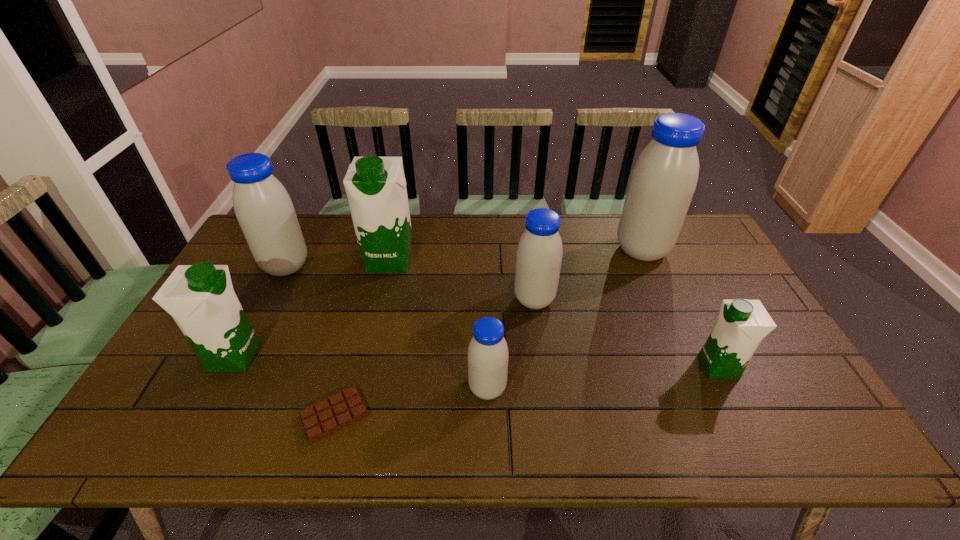
The height and width of the screenshot is (540, 960). What are the coordinates of `the fourth soya milk from left to right` in the screenshot? It's located at (488, 355).

Identify the location of the shortest object. Image resolution: width=960 pixels, height=540 pixels. (328, 416).

You are a GUI agent. You are given a task and a screenshot of the screen. Output one action in this format:
    pyautogui.click(x=<x>, y=<y>)
    Task: Click on the vacant space located on the left of the tallest object
    The width and height of the screenshot is (960, 540).
    Given the screenshot: What is the action you would take?
    pyautogui.click(x=526, y=250)

Find the location of a particular element. This screenshot has width=960, height=540. blank space located 0.080m on the front-facing side of the biggest green soya milk is located at coordinates coord(381,294).

At what (x,y) coordinates should I click in order to perform the action: click on free location located 0.290m on the front of the leftmost blue soya milk. Please return your answer as a coordinate pair (x, y). Looking at the image, I should click on (240, 357).

This screenshot has width=960, height=540. Identify the location of free space located on the right of the fourth farthest object. (612, 299).

Where is `blank space located on the front-facing side of the leftmost green soya milk`? blank space located on the front-facing side of the leftmost green soya milk is located at coordinates (286, 356).

The width and height of the screenshot is (960, 540). In order to click on free location located on the front-facing side of the rightmost green soya milk in this screenshot , I will do `click(614, 367)`.

At what (x,y) coordinates should I click in order to perform the action: click on free space located 0.380m on the front-facing side of the rightmost green soya milk. Please return your answer as a coordinate pair (x, y). The width and height of the screenshot is (960, 540). Looking at the image, I should click on (552, 367).

Locate an element on the screen. This screenshot has width=960, height=540. vacant space located 0.320m on the front-facing side of the rightmost green soya milk is located at coordinates (575, 367).